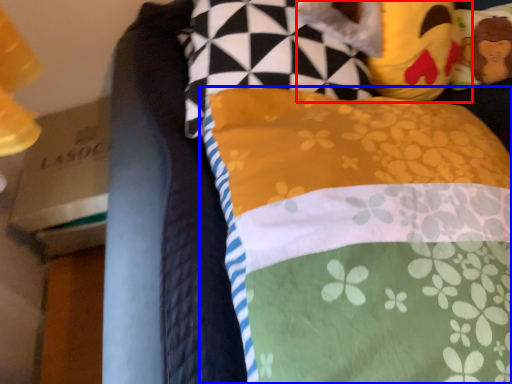
Question: Which object appears farthest to the camera in this image, figurine (highlighted by a red box) or pillow (highlighted by a blue box)?

Choices:
 (A) figurine
 (B) pillow

Answer: (A)